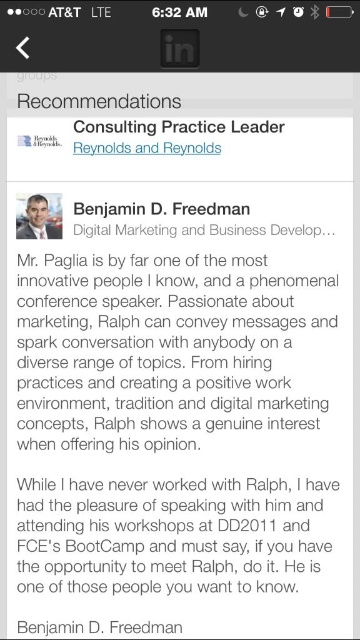
This screenshot has height=640, width=360. What do you see at coordinates (182, 419) in the screenshot?
I see `black paper text at upper center` at bounding box center [182, 419].

Is point (135, 385) closer to viewer compared to point (55, 225)?

No, it is behind (55, 225).

This screenshot has height=640, width=360. I want to click on black paper text at upper center, so click(x=182, y=419).